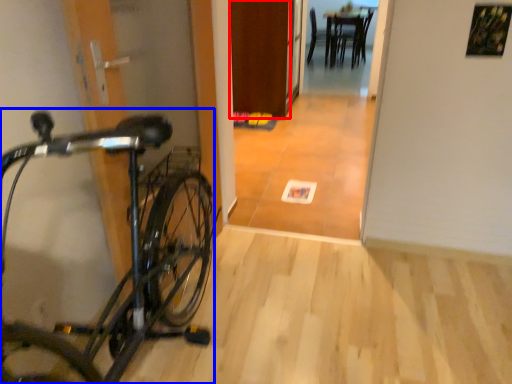
Question: Which point is further to the camera, door (highlighted by a red box) or bicycle (highlighted by a blue box)?

Choices:
 (A) door
 (B) bicycle

Answer: (A)